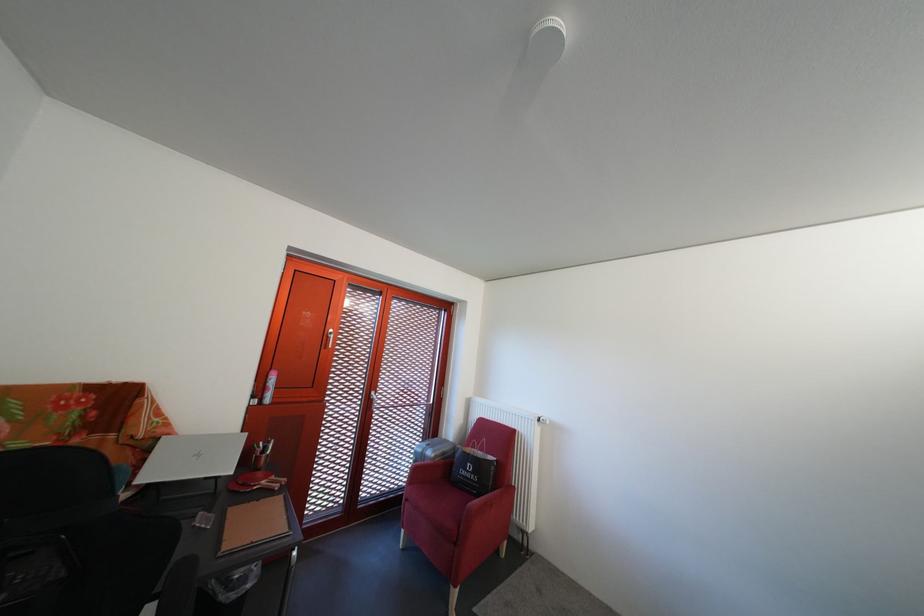
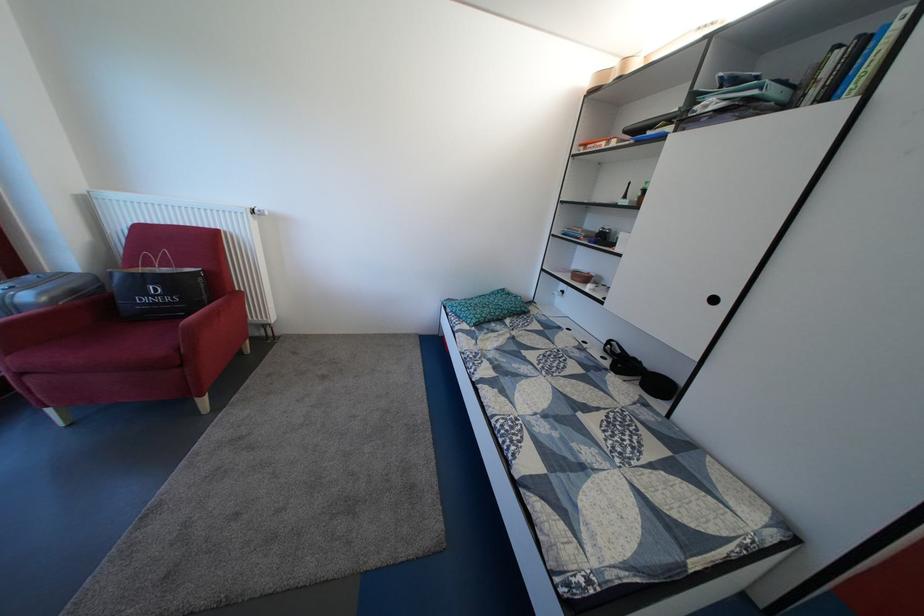
In the second image, find the point that corresponds to pixel 477 476 in the first image.

(159, 302)